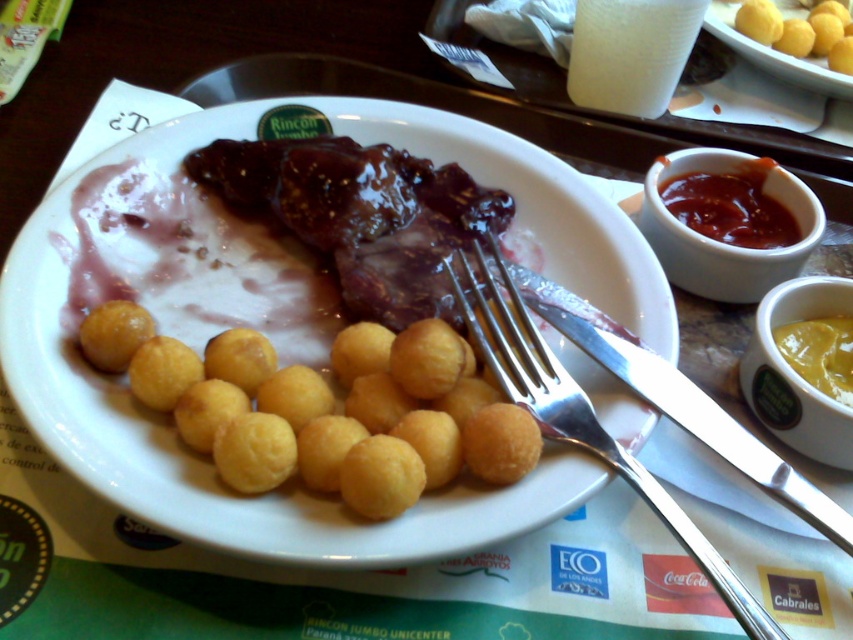
Consider the image. Who is positioned more to the left, golden fried balls at center or white paper cup at upper center?

From the viewer's perspective, golden fried balls at center appears more on the left side.

Which is in front, point (360, 232) or point (647, 108)?

Point (360, 232)

Which is in front, point (364, 296) or point (624, 13)?

Point (364, 296) is more forward.

Where is `golden fried balls at center`? This screenshot has height=640, width=853. golden fried balls at center is located at coordinates (358, 234).

Is smooth matte ketchup at upper right shorter than yellow creamy sauce at upper right?

In fact, smooth matte ketchup at upper right may be taller than yellow creamy sauce at upper right.

Which is above, smooth matte ketchup at upper right or yellow creamy sauce at upper right?

smooth matte ketchup at upper right is higher up.

Which is in front, point (683, 172) or point (821, 342)?

Point (821, 342) is more forward.

Locate an element on the screen. Image resolution: width=853 pixels, height=640 pixels. smooth matte ketchup at upper right is located at coordinates (730, 205).

Does yellow matte balls at upper right have a greater width compared to yellow creamy sauce at upper right?

Correct, the width of yellow matte balls at upper right exceeds that of yellow creamy sauce at upper right.

Does point (764, 19) come farther from viewer compared to point (845, 378)?

Yes, it is behind point (845, 378).

Locate an element on the screen. This screenshot has width=853, height=640. yellow matte balls at upper right is located at coordinates (799, 32).